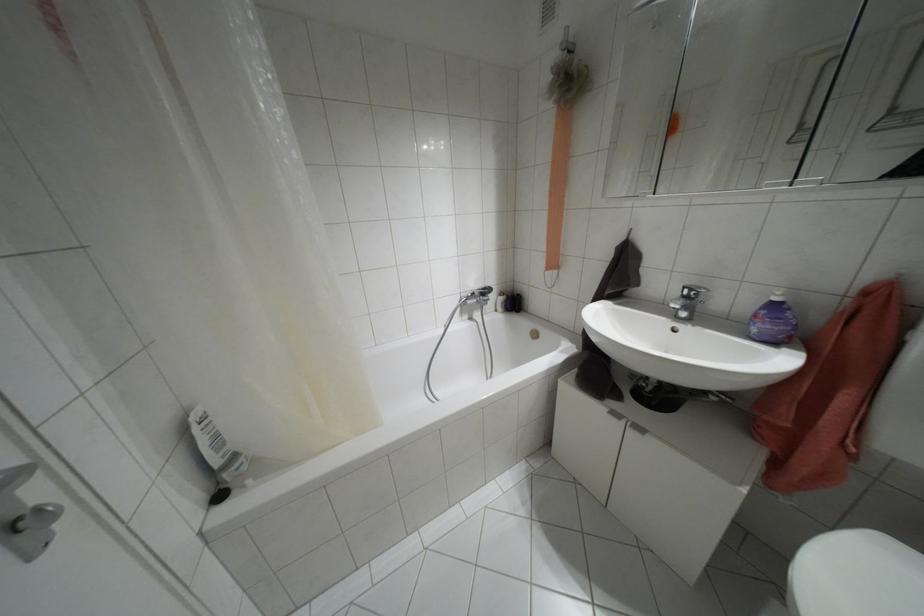
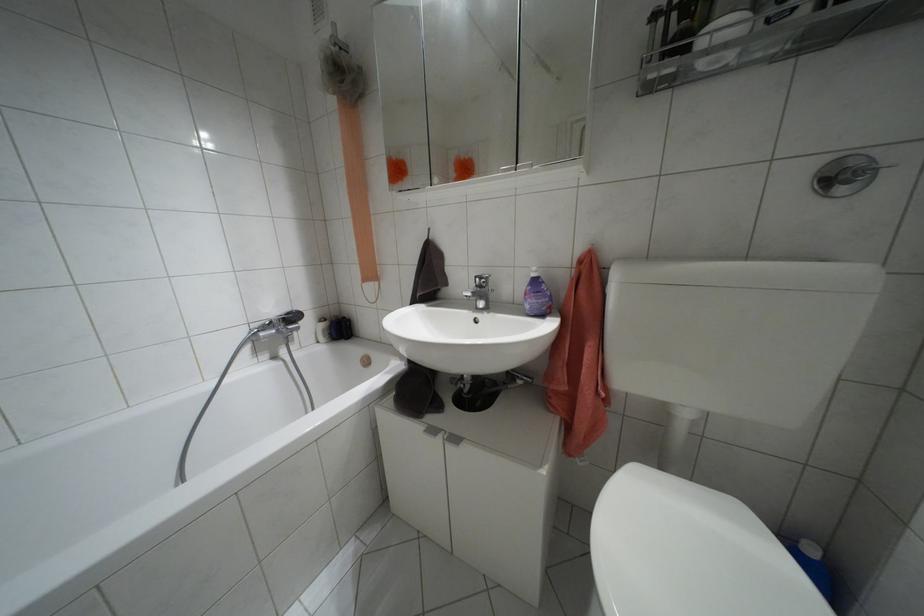
Find the pixel in the second image that matches the point at 774,299 in the first image.

(532, 274)